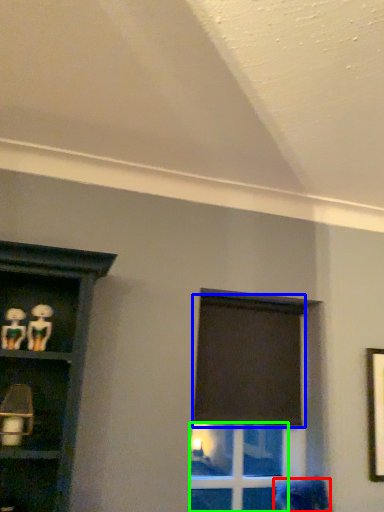
Question: Which is nearer to the woman (highlighted by a red box)? curtain (highlighted by a blue box) or glass door (highlighted by a green box).

Choices:
 (A) curtain
 (B) glass door

Answer: (A)